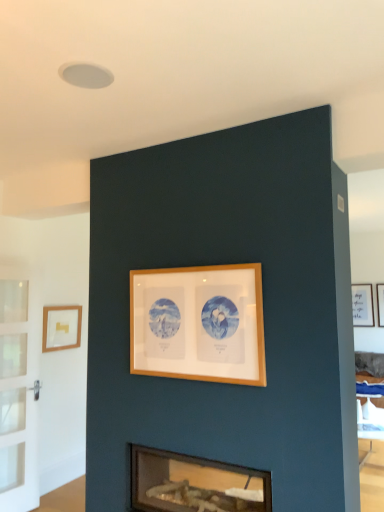
Question: Which direction should I rotate to face wooden frame at center, marked as the 2th picture frame in a left-to-right arrangement, — up or down?

Choices:
 (A) up
 (B) down

Answer: (B)

Question: Considering the relative positions of wooden frame at center, marked as the first picture frame in a front-to-back arrangement, and matte gold picture frame at left, the second picture frame from the front, in the image provided, is wooden frame at center, marked as the first picture frame in a front-to-back arrangement, to the left of matte gold picture frame at left, the second picture frame from the front, from the viewer's perspective?

Choices:
 (A) yes
 (B) no

Answer: (B)

Question: From the image's perspective, is wooden frame at center, which ranks as the third picture frame in back-to-front order, located above matte gold picture frame at left, which ranks as the third picture frame in right-to-left order?

Choices:
 (A) yes
 (B) no

Answer: (A)

Question: Is wooden frame at center, the 2th picture frame viewed from the right, not within matte gold picture frame at left, the second picture frame from the front?

Choices:
 (A) no
 (B) yes

Answer: (B)

Question: From a real-world perspective, is wooden frame at center, marked as the first picture frame in a front-to-back arrangement, located beneath matte gold picture frame at left, which is the 1th picture frame from left to right?

Choices:
 (A) yes
 (B) no

Answer: (B)

Question: Is wooden frame at center, the 2th picture frame viewed from the right, positioned far away from matte gold picture frame at left, which appears as the 2th picture frame when viewed from the back?

Choices:
 (A) no
 (B) yes

Answer: (B)

Question: From the image's perspective, does wooden frame at center, which ranks as the third picture frame in back-to-front order, appear lower than matte gold picture frame at left, which is the 1th picture frame from left to right?

Choices:
 (A) no
 (B) yes

Answer: (A)

Question: From the image's perspective, does white matte picture frame at upper right, which is counted as the 3th picture frame, starting from the left, appear higher than wooden frame at center, which ranks as the third picture frame in back-to-front order?

Choices:
 (A) yes
 (B) no

Answer: (B)

Question: From a real-world perspective, is white matte picture frame at upper right, the 1th picture frame when ordered from back to front, physically above wooden frame at center, marked as the first picture frame in a front-to-back arrangement?

Choices:
 (A) no
 (B) yes

Answer: (A)

Question: Is wooden frame at center, which ranks as the third picture frame in back-to-front order, located within white matte picture frame at upper right, the 1th picture frame when ordered from back to front?

Choices:
 (A) yes
 (B) no

Answer: (B)

Question: Is white matte picture frame at upper right, which is counted as the 3th picture frame, starting from the left, not inside wooden frame at center, the 2th picture frame viewed from the right?

Choices:
 (A) yes
 (B) no

Answer: (A)

Question: Can you confirm if white matte picture frame at upper right, the 1th picture frame when ordered from back to front, is wider than wooden frame at center, the 2th picture frame viewed from the right?

Choices:
 (A) yes
 (B) no

Answer: (A)

Question: Does white matte picture frame at upper right, which is counted as the 3th picture frame, starting from the left, have a lesser height compared to wooden frame at center, marked as the first picture frame in a front-to-back arrangement?

Choices:
 (A) no
 (B) yes

Answer: (A)

Question: From a real-world perspective, does matte glass fireplace at lower center stand above wooden frame at center, marked as the 2th picture frame in a left-to-right arrangement?

Choices:
 (A) yes
 (B) no

Answer: (B)